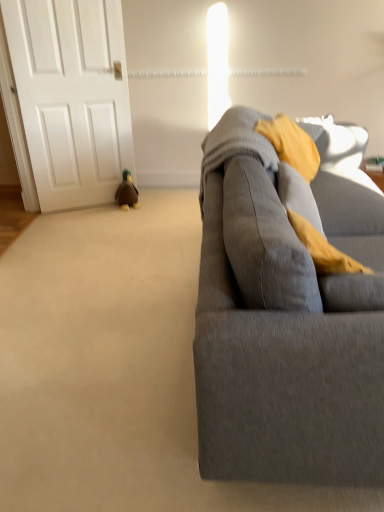
Question: From a real-world perspective, is gray fabric couch at right physically below white matte door at left?

Choices:
 (A) yes
 (B) no

Answer: (A)

Question: From the image's perspective, is gray fabric couch at right on top of white matte door at left?

Choices:
 (A) yes
 (B) no

Answer: (B)

Question: From a real-world perspective, is gray fabric couch at right located higher than white matte door at left?

Choices:
 (A) no
 (B) yes

Answer: (A)

Question: Considering the relative sizes of gray fabric couch at right and white matte door at left in the image provided, is gray fabric couch at right smaller than white matte door at left?

Choices:
 (A) yes
 (B) no

Answer: (B)

Question: Are gray fabric couch at right and white matte door at left far apart?

Choices:
 (A) yes
 (B) no

Answer: (A)

Question: Does gray fabric couch at right have a lesser height compared to white matte door at left?

Choices:
 (A) no
 (B) yes

Answer: (B)

Question: Is brown plush duck at lower left smaller than white matte door at left?

Choices:
 (A) yes
 (B) no

Answer: (A)

Question: Is brown plush duck at lower left oriented towards white matte door at left?

Choices:
 (A) no
 (B) yes

Answer: (A)

Question: Considering the relative positions of brown plush duck at lower left and white matte door at left in the image provided, is brown plush duck at lower left in front of white matte door at left?

Choices:
 (A) yes
 (B) no

Answer: (B)

Question: Is there a large distance between brown plush duck at lower left and white matte door at left?

Choices:
 (A) yes
 (B) no

Answer: (B)

Question: From a real-world perspective, is brown plush duck at lower left positioned under white matte door at left based on gravity?

Choices:
 (A) no
 (B) yes

Answer: (B)

Question: Is brown plush duck at lower left wider than white matte door at left?

Choices:
 (A) no
 (B) yes

Answer: (B)

Question: From the image's perspective, is white matte door at left on gray fabric couch at right?

Choices:
 (A) yes
 (B) no

Answer: (A)